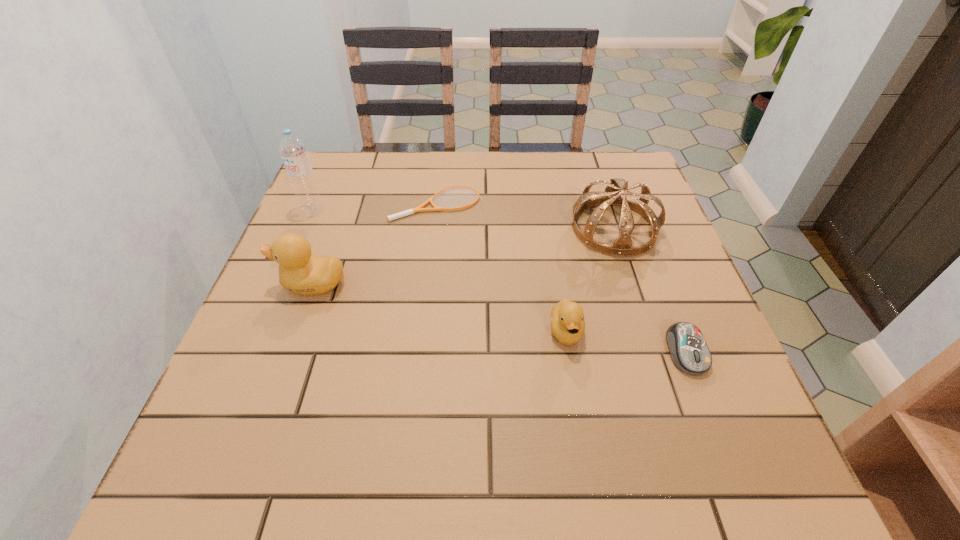
At what (x,y) coordinates should I click in order to perform the action: click on free space between the fourth object from right to left and the water bottle. Please return your answer as a coordinate pair (x, y). Looking at the image, I should click on (375, 206).

The height and width of the screenshot is (540, 960). Find the location of `vacant area that lies between the right duckling and the computer mouse`. vacant area that lies between the right duckling and the computer mouse is located at coordinates (626, 342).

Locate an element on the screen. This screenshot has width=960, height=540. free space between the shortest object and the nearer duckling is located at coordinates point(502,267).

The width and height of the screenshot is (960, 540). What are the coordinates of `unoccupied area between the tennis racket and the tiara` in the screenshot? It's located at (526, 215).

Where is `free space between the shortest object and the left duckling`? free space between the shortest object and the left duckling is located at coordinates (374, 244).

Select which object is the second closest to the second shortest object. Please provide its 2D coordinates. Your answer should be formatted as a tuple, i.e. [(x, y)], where the tuple contains the x and y coordinates of a point satisfying the conditions above.

[(621, 247)]

This screenshot has height=540, width=960. In order to click on object that is the fifth nearest to the nearer duckling in this screenshot , I will do `click(300, 173)`.